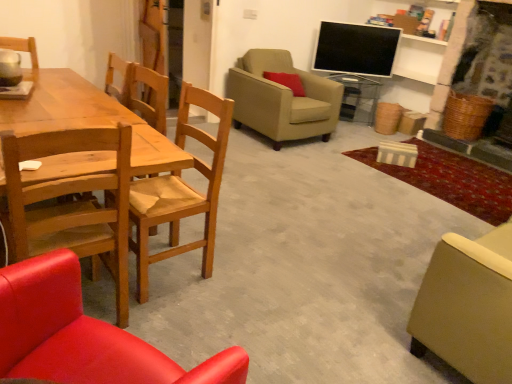
Question: From the image's perspective, is matte red pillow at upper center positioned above or below wooden chair at left, the second chair viewed from the front?

Choices:
 (A) above
 (B) below

Answer: (A)

Question: In the image, is matte red pillow at upper center on the left side or the right side of wooden chair at left, the fourth chair viewed from the back?

Choices:
 (A) right
 (B) left

Answer: (A)

Question: Estimate the real-world distances between objects in this image. Which object is farther from the wooden chair at left, the fourth chair viewed from the back?

Choices:
 (A) wooden chair at left, which is counted as the fourth chair, starting from the front
 (B) matte beige armchair at lower right, acting as the third chair starting from the front
 (C) matte wood chair at lower left, the 1th chair in the front-to-back sequence
 (D) flat screen tv at upper right
 (E) matte red pillow at upper center

Answer: (D)

Question: Which object is positioned farthest from the flat screen tv at upper right?

Choices:
 (A) matte wood chair at lower left, the 1th chair in the front-to-back sequence
 (B) transparent glass side table at center
 (C) beige fabric armchair at center, acting as the 1th chair starting from the back
 (D) wooden chair at left, which appears as the second chair when viewed from the back
 (E) wooden chair at left, the fourth chair viewed from the back

Answer: (A)